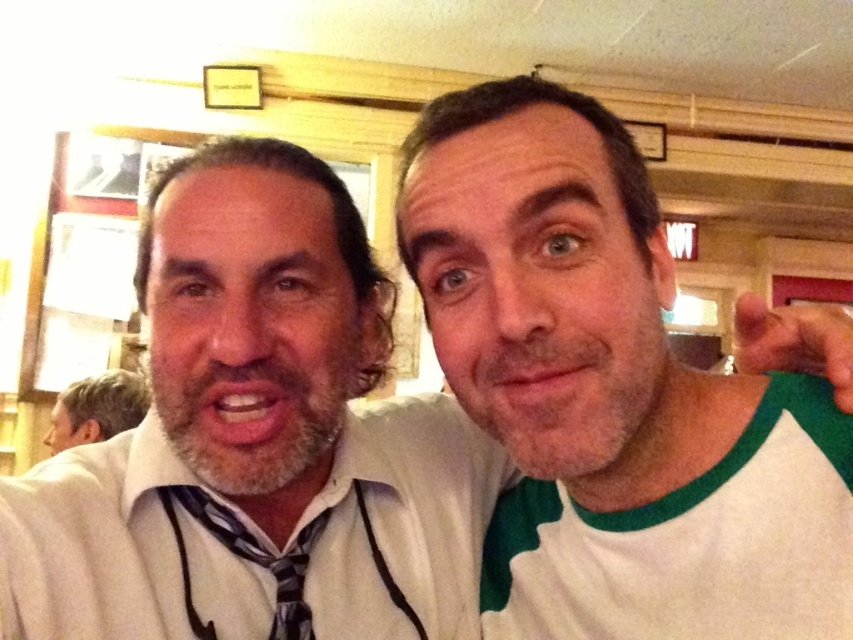
Consider the image. You are standing in the same room as the two people in the image. You want to locate the striped fabric tie at center. Where would you look relative to the two people?

The striped fabric tie at center is located at point coordinates of 0.875 on the x axis and 0.291 on the y axis.